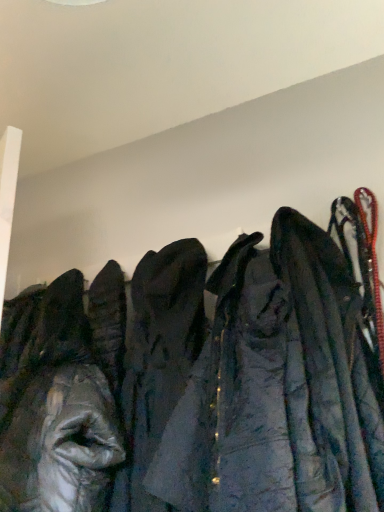
Question: Is dark gray fabric coat at center, which appears as the 1th cloak when viewed from the left, not inside shiny silver jacket at left?

Choices:
 (A) no
 (B) yes

Answer: (B)

Question: From a real-world perspective, is dark gray fabric coat at center, which is the second cloak from right to left, positioned over shiny silver jacket at left based on gravity?

Choices:
 (A) no
 (B) yes

Answer: (A)

Question: From the image's perspective, is dark gray fabric coat at center, which is the second cloak from right to left, on top of shiny silver jacket at left?

Choices:
 (A) yes
 (B) no

Answer: (A)

Question: From a real-world perspective, is dark gray fabric coat at center, which appears as the 1th cloak when viewed from the left, positioned under shiny silver jacket at left based on gravity?

Choices:
 (A) no
 (B) yes

Answer: (B)

Question: Does dark gray fabric coat at center, which is the second cloak from right to left, have a larger size compared to shiny silver jacket at left?

Choices:
 (A) yes
 (B) no

Answer: (B)

Question: Is dark gray fabric coat at center, which is the second cloak from right to left, shorter than shiny silver jacket at left?

Choices:
 (A) yes
 (B) no

Answer: (A)

Question: Is dark blue fabric coat at right, which is the 1th cloak in right-to-left order, to the right of dark gray fabric coat at center, which appears as the 1th cloak when viewed from the left, from the viewer's perspective?

Choices:
 (A) no
 (B) yes

Answer: (B)

Question: Is dark blue fabric coat at right, which is counted as the second cloak, starting from the left, positioned beyond the bounds of dark gray fabric coat at center, which is the second cloak from right to left?

Choices:
 (A) yes
 (B) no

Answer: (A)

Question: Can you confirm if dark blue fabric coat at right, which is the 1th cloak in right-to-left order, is smaller than dark gray fabric coat at center, which is the second cloak from right to left?

Choices:
 (A) no
 (B) yes

Answer: (A)

Question: Is dark blue fabric coat at right, which is counted as the second cloak, starting from the left, surrounding dark gray fabric coat at center, which appears as the 1th cloak when viewed from the left?

Choices:
 (A) yes
 (B) no

Answer: (B)

Question: From the image's perspective, is dark blue fabric coat at right, which is counted as the second cloak, starting from the left, located beneath dark gray fabric coat at center, which is the second cloak from right to left?

Choices:
 (A) no
 (B) yes

Answer: (A)

Question: Is the position of dark blue fabric coat at right, which is counted as the second cloak, starting from the left, less distant than that of dark gray fabric coat at center, which appears as the 1th cloak when viewed from the left?

Choices:
 (A) yes
 (B) no

Answer: (A)

Question: Is dark gray fabric coat at center, which is the second cloak from right to left, outside of dark blue fabric coat at right, which is the 1th cloak in right-to-left order?

Choices:
 (A) yes
 (B) no

Answer: (A)